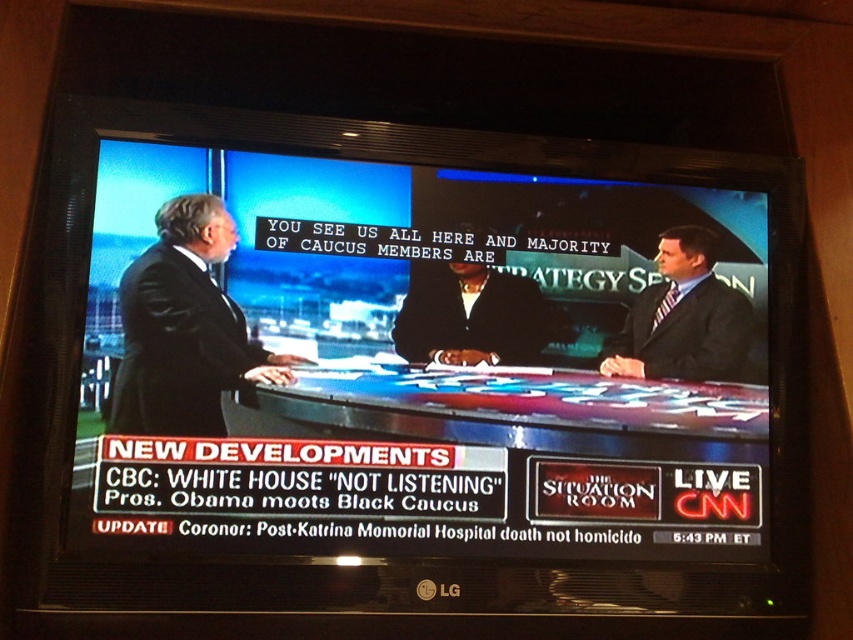
Question: Which object is farther from the camera taking this photo?

Choices:
 (A) black suit at left
 (B) dark suit at center
 (C) matte black suit at right

Answer: (C)

Question: Where is matte black table at center located in relation to black suit at left in the image?

Choices:
 (A) right
 (B) left

Answer: (A)

Question: Is black suit at left positioned in front of matte black suit at right?

Choices:
 (A) yes
 (B) no

Answer: (A)

Question: Among these points, which one is farthest from the camera?

Choices:
 (A) (442, 308)
 (B) (728, 353)
 (C) (173, 236)
 (D) (630, 508)

Answer: (B)

Question: Which is nearer to the matte black suit at right?

Choices:
 (A) matte black table at center
 (B) black suit at left
 (C) dark suit at center

Answer: (C)

Question: Does black suit at left have a lesser width compared to matte black suit at right?

Choices:
 (A) yes
 (B) no

Answer: (B)